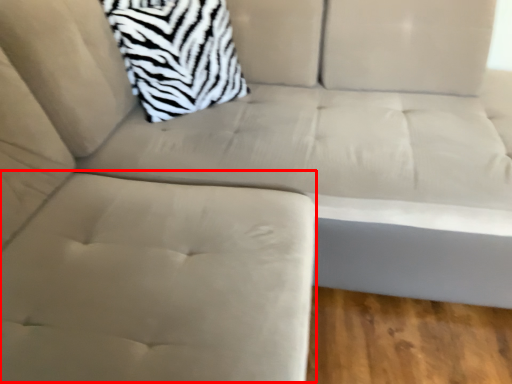
Question: Observing the image, what is the correct spatial positioning of swivel chair (annotated by the red box) in reference to throw pillow?

Choices:
 (A) right
 (B) left

Answer: (B)